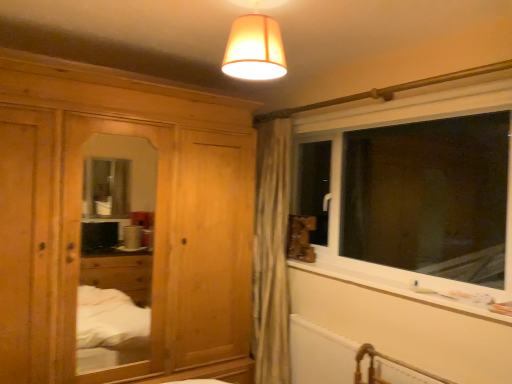
Identify the location of empty space that is ontop of white plastic window sill at lower right (from a real-world perspective). (371, 281).